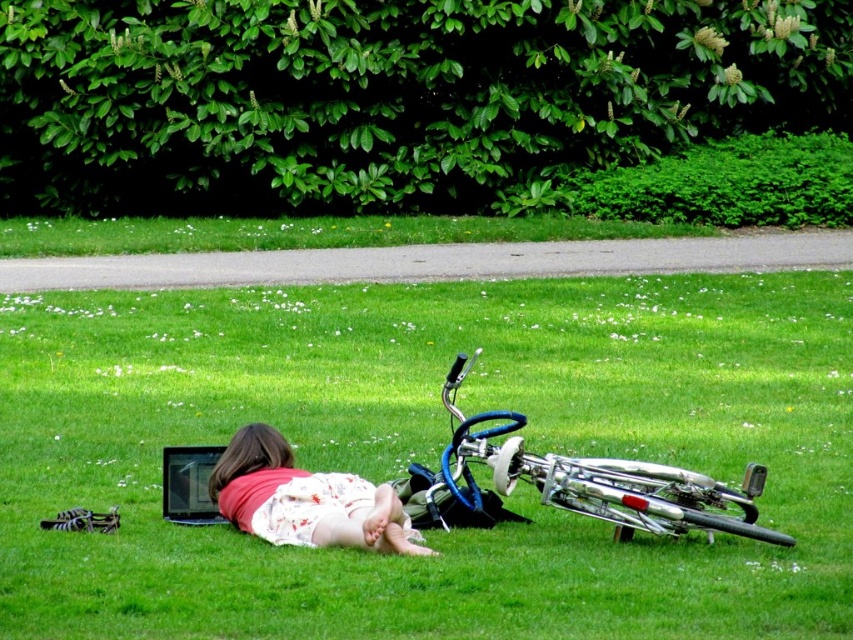
Question: Which object appears closest to the camera in this image?

Choices:
 (A) silver metallic bicycle at lower center
 (B) floral dress at center

Answer: (B)

Question: Does green grass at center lie in front of floral dress at center?

Choices:
 (A) no
 (B) yes

Answer: (B)

Question: Estimate the real-world distances between objects in this image. Which object is farther from the floral dress at center?

Choices:
 (A) green grass at center
 (B) silver metallic bicycle at lower center

Answer: (A)

Question: Is silver metallic bicycle at lower center thinner than floral dress at center?

Choices:
 (A) no
 (B) yes

Answer: (A)

Question: Can you confirm if green grass at center is positioned above floral dress at center?

Choices:
 (A) yes
 (B) no

Answer: (A)

Question: Which point appears closest to the camera in this image?

Choices:
 (A) (378, 508)
 (B) (183, 308)

Answer: (A)